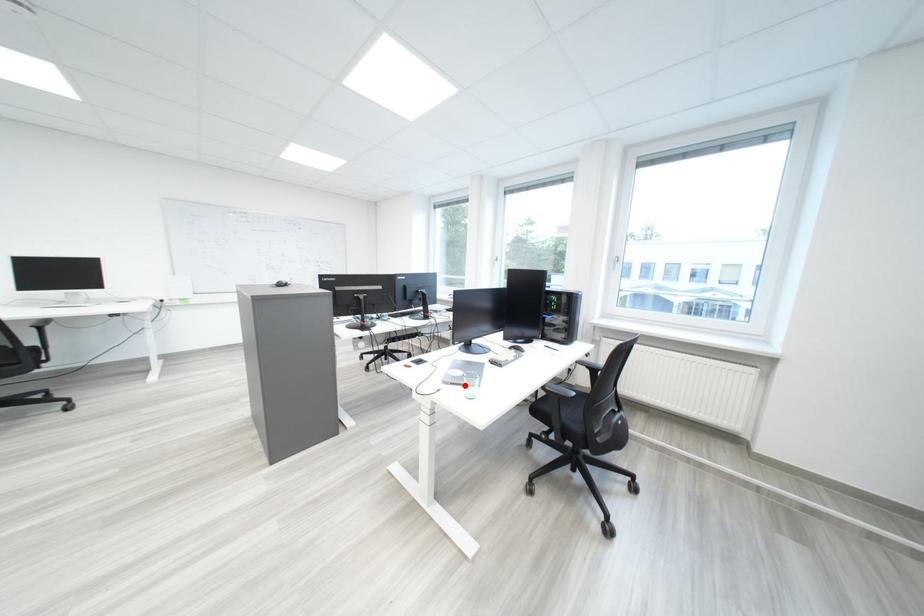
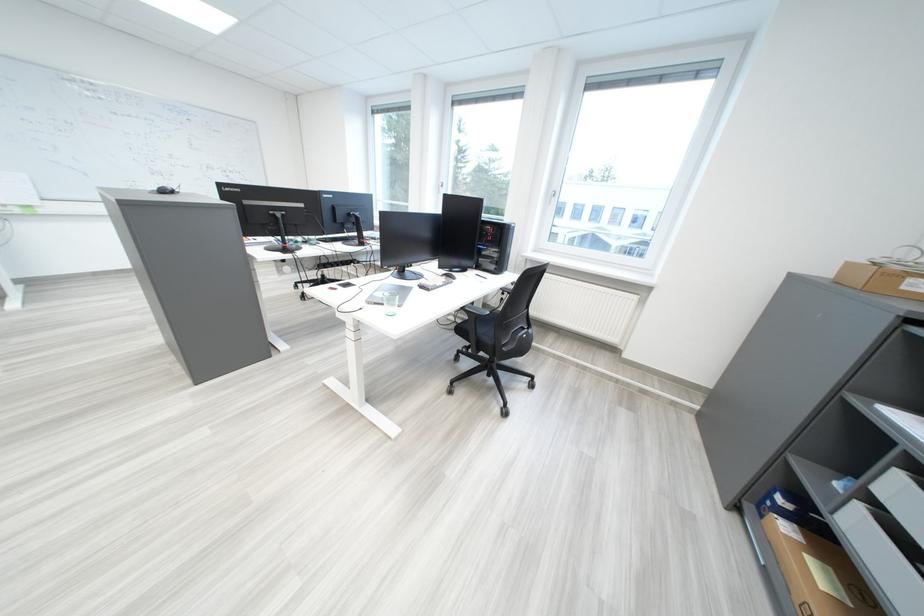
Find the pixel in the second image that matches the highlighted location in the first image.

(388, 305)